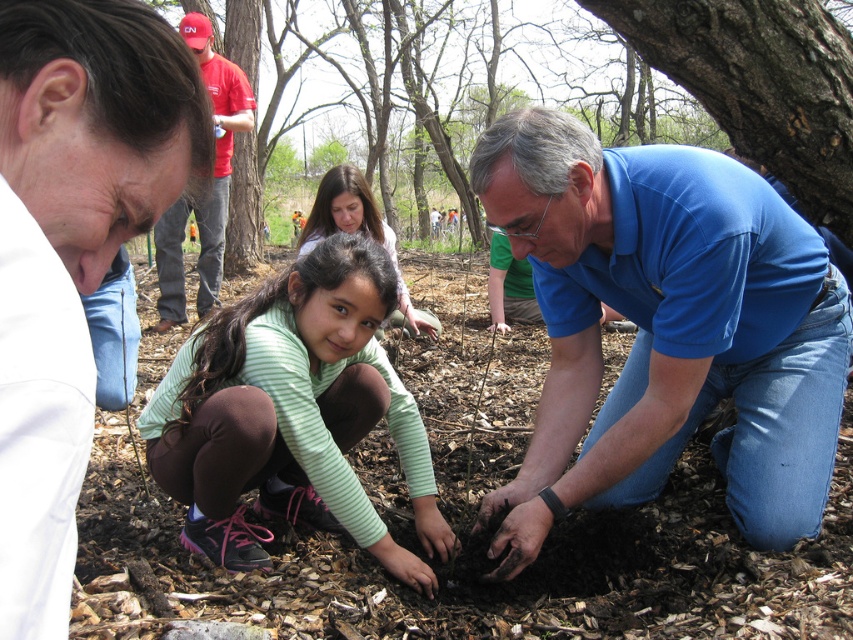
Does smooth bark tree at upper right have a greater height compared to red cotton shirt at upper left?

No.

Measure the distance between smooth bark tree at upper right and red cotton shirt at upper left.

smooth bark tree at upper right and red cotton shirt at upper left are 12.35 feet apart.

Identify the location of smooth bark tree at upper right. (759, 84).

You are a GUI agent. You are given a task and a screenshot of the screen. Output one action in this format:
    pyautogui.click(x=<x>, y=<y>)
    Task: Click on the smooth bark tree at upper right
    
    Given the screenshot: What is the action you would take?
    pyautogui.click(x=759, y=84)

Can you confirm if blue cotton shirt at lower right is bigger than smooth bark tree at upper right?

Yes.

Between point (694, 326) and point (709, 83), which one is positioned behind?

The point (709, 83) is more distant.

Locate an element on the screen. The width and height of the screenshot is (853, 640). blue cotton shirt at lower right is located at coordinates (665, 328).

I want to click on blue cotton shirt at lower right, so click(665, 328).

Which is more to the right, green striped shirt at center or smooth bark tree at upper right?

smooth bark tree at upper right is more to the right.

Between point (202, 348) and point (790, 138), which one is positioned in front?

Point (202, 348) is more forward.

Which is behind, point (352, 364) or point (709, 52)?

Point (709, 52)

At what (x,y) coordinates should I click in order to perform the action: click on green striped shirt at center. Please return your answer as a coordinate pair (x, y). This screenshot has height=640, width=853. Looking at the image, I should click on (293, 408).